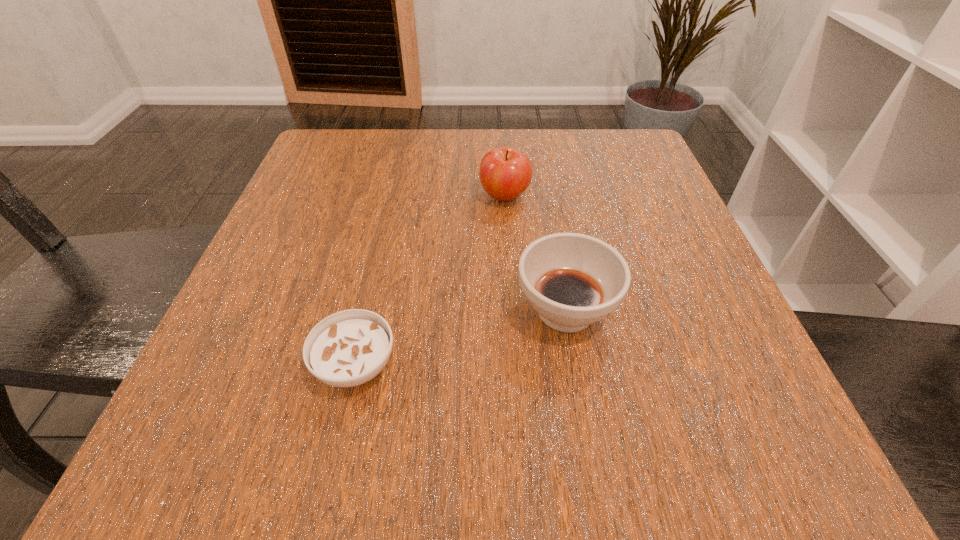
Locate an element on the screen. The width and height of the screenshot is (960, 540). apple is located at coordinates (505, 173).

Where is `the taller soup bowl`? Image resolution: width=960 pixels, height=540 pixels. the taller soup bowl is located at coordinates (572, 280).

Find the location of a particular element. Image resolution: width=960 pixels, height=540 pixels. the shortest object is located at coordinates (348, 348).

Locate an element on the screen. the leftmost object is located at coordinates (348, 348).

Identify the location of free location located on the front of the farthest object. (511, 285).

Find the location of `free space located 0.200m on the left of the taller soup bowl`. free space located 0.200m on the left of the taller soup bowl is located at coordinates (384, 310).

You are a GUI agent. You are given a task and a screenshot of the screen. Output one action in this format:
    pyautogui.click(x=<x>, y=<y>)
    Task: Click on the free spot located on the back of the left soup bowl
    The height and width of the screenshot is (540, 960).
    Given the screenshot: What is the action you would take?
    pyautogui.click(x=384, y=241)

Identify the location of object that is at the far edge. The height and width of the screenshot is (540, 960). (505, 173).

You are a GUI agent. You are given a task and a screenshot of the screen. Output one action in this format:
    pyautogui.click(x=<x>, y=<y>)
    Task: Click on the object present at the left edge
    This screenshot has height=540, width=960.
    Given the screenshot: What is the action you would take?
    pyautogui.click(x=348, y=348)

Find the location of `blank area at the far edge`. blank area at the far edge is located at coordinates (525, 141).